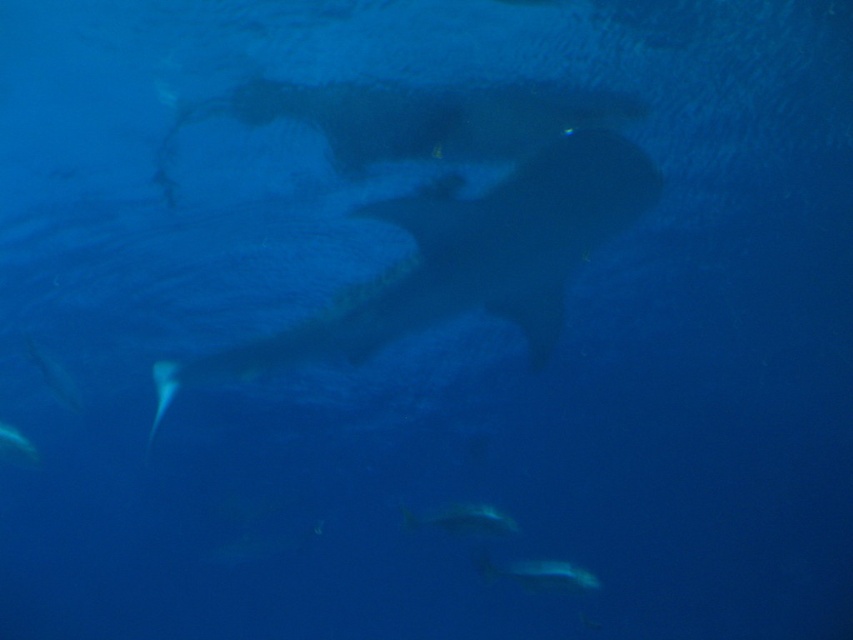
Question: Which point is farther to the camera?

Choices:
 (A) dark gray matte shark at center
 (B) translucent blue fish at lower left
 (C) shiny silver fish at lower left
 (D) shiny silver fish at center

Answer: (B)

Question: Observing the image, what is the correct spatial positioning of dark gray matte shark at center in reference to translucent blue fish at lower center?

Choices:
 (A) left
 (B) right

Answer: (A)

Question: Which object is positioned farthest from the translucent blue fish at lower center?

Choices:
 (A) shiny silver fish at lower left
 (B) dark gray matte shark at center

Answer: (A)

Question: Does shiny silver fish at lower left have a smaller size compared to translucent blue fish at lower left?

Choices:
 (A) yes
 (B) no

Answer: (B)

Question: Among these points, which one is nearest to the camera?

Choices:
 (A) (28, 451)
 (B) (451, 316)
 (C) (566, 584)
 (D) (30, 342)

Answer: (C)

Question: Does dark gray matte shark at center have a greater width compared to translucent blue fish at lower center?

Choices:
 (A) yes
 (B) no

Answer: (A)